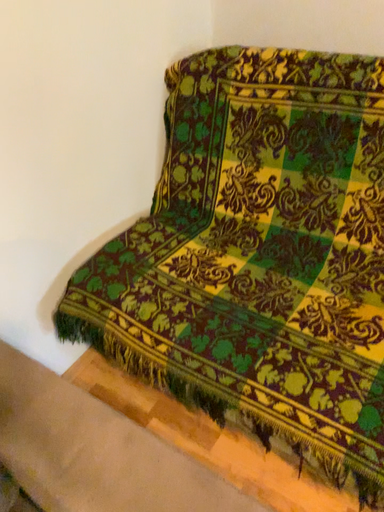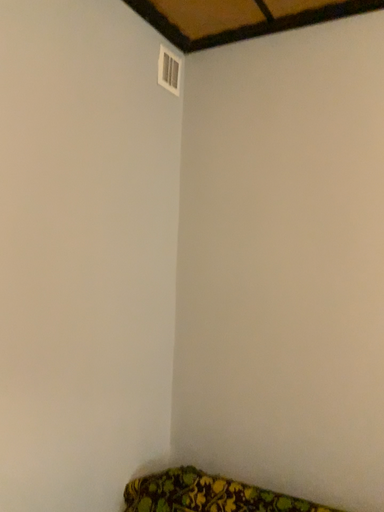
Question: Which way did the camera rotate in the video?

Choices:
 (A) rotated left
 (B) rotated right

Answer: (B)